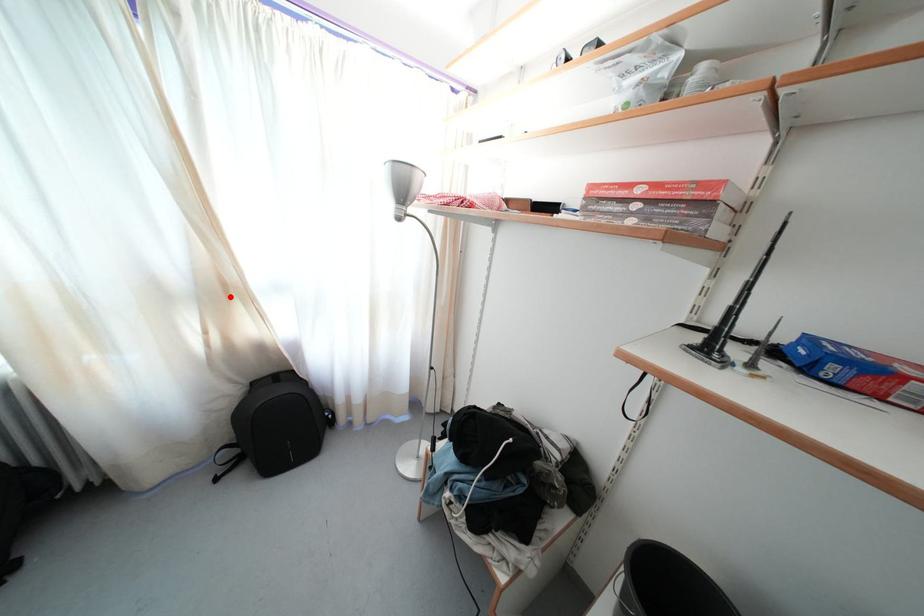
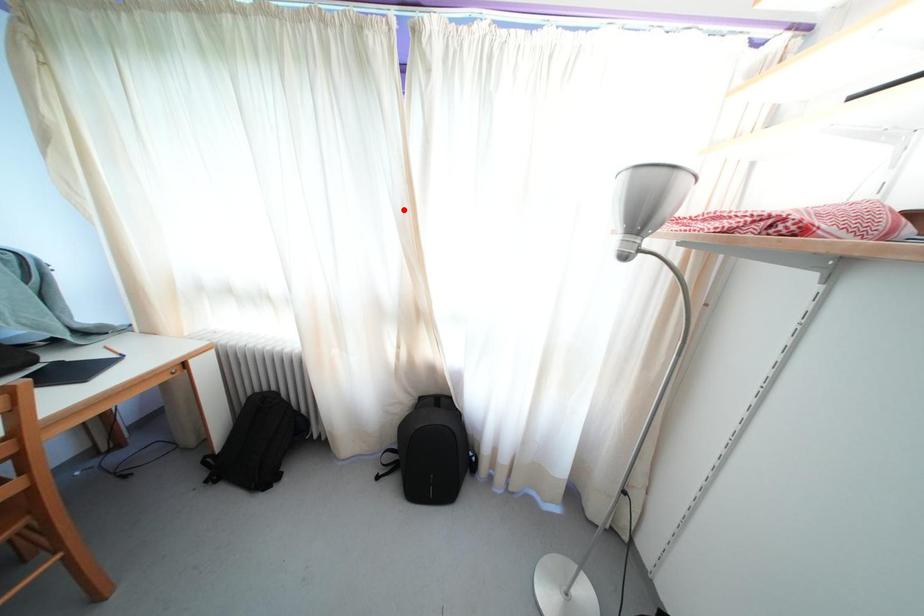
I am providing you with two images of the same scene from different viewpoints. A red point is marked on the first image and another point is marked on the second image. Are the points marked in image1 and image2 representing the same 3D position?

No